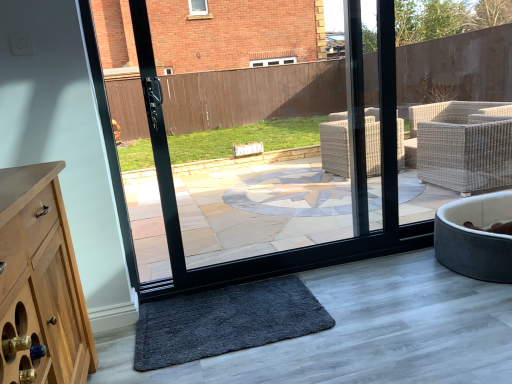
Question: From the image's perspective, is dark gray shaggy mat at lower center over velvet grey pet bed at lower right?

Choices:
 (A) yes
 (B) no

Answer: (B)

Question: Does dark gray shaggy mat at lower center come behind velvet grey pet bed at lower right?

Choices:
 (A) no
 (B) yes

Answer: (A)

Question: Considering the relative sizes of dark gray shaggy mat at lower center and velvet grey pet bed at lower right in the image provided, is dark gray shaggy mat at lower center thinner than velvet grey pet bed at lower right?

Choices:
 (A) no
 (B) yes

Answer: (B)

Question: Is dark gray shaggy mat at lower center turned away from velvet grey pet bed at lower right?

Choices:
 (A) yes
 (B) no

Answer: (B)

Question: Is velvet grey pet bed at lower right located within dark gray shaggy mat at lower center?

Choices:
 (A) no
 (B) yes

Answer: (A)

Question: Does dark gray shaggy mat at lower center have a smaller size compared to velvet grey pet bed at lower right?

Choices:
 (A) no
 (B) yes

Answer: (B)

Question: Can you confirm if velvet grey pet bed at lower right is positioned to the left of dark gray shaggy mat at lower center?

Choices:
 (A) yes
 (B) no

Answer: (B)

Question: From a real-world perspective, is velvet grey pet bed at lower right on dark gray shaggy mat at lower center?

Choices:
 (A) yes
 (B) no

Answer: (A)

Question: Is velvet grey pet bed at lower right positioned with its back to dark gray shaggy mat at lower center?

Choices:
 (A) yes
 (B) no

Answer: (B)

Question: Is velvet grey pet bed at lower right outside of dark gray shaggy mat at lower center?

Choices:
 (A) no
 (B) yes

Answer: (B)

Question: Does velvet grey pet bed at lower right lie behind dark gray shaggy mat at lower center?

Choices:
 (A) yes
 (B) no

Answer: (A)

Question: Is velvet grey pet bed at lower right bigger than dark gray shaggy mat at lower center?

Choices:
 (A) no
 (B) yes

Answer: (B)

Question: In terms of width, does dark gray shaggy mat at lower center look wider or thinner when compared to velvet grey pet bed at lower right?

Choices:
 (A) wide
 (B) thin

Answer: (B)